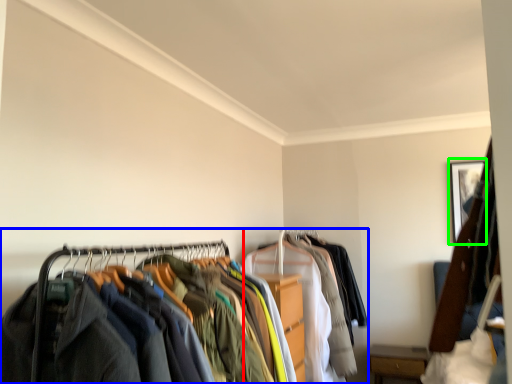
Question: Which object is the closest to the garment (highlighted by a red box)? Choose among these: closet (highlighted by a blue box) or picture frame (highlighted by a green box).

Choices:
 (A) closet
 (B) picture frame

Answer: (A)